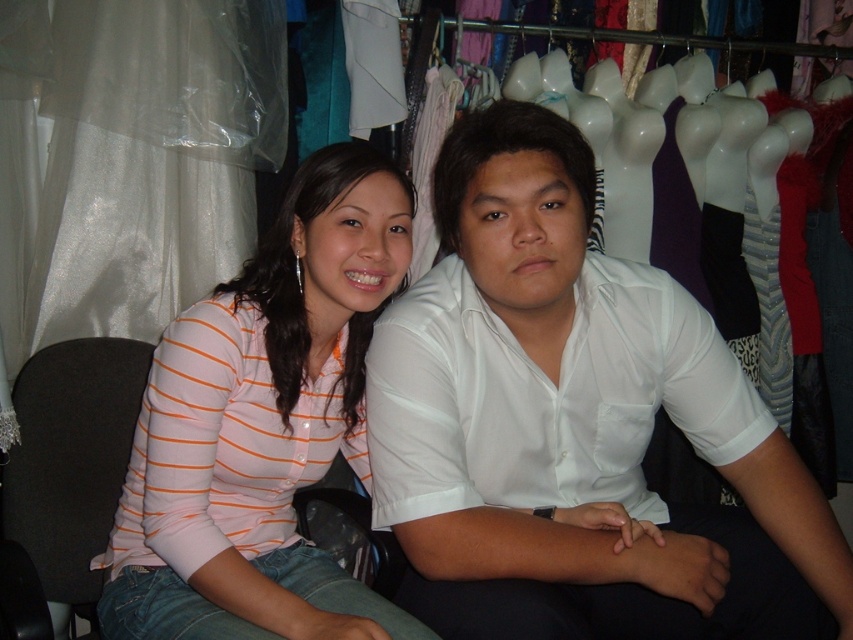
Question: Does white smooth shirt at center appear over pink striped shirt at center?

Choices:
 (A) yes
 (B) no

Answer: (B)

Question: Which point is farther to the camera?

Choices:
 (A) (701, 513)
 (B) (9, 477)
 (C) (265, 580)

Answer: (A)

Question: Which point is farther to the camera?

Choices:
 (A) (67, 572)
 (B) (273, 577)
 (C) (537, 237)

Answer: (A)

Question: Which point is farther to the camera?

Choices:
 (A) (113, 413)
 (B) (322, 152)
 (C) (387, 426)

Answer: (A)

Question: Is the position of white smooth shirt at center more distant than that of black fabric chair at left?

Choices:
 (A) yes
 (B) no

Answer: (B)

Question: Where is white smooth shirt at center located in relation to black fabric chair at left in the image?

Choices:
 (A) right
 (B) left

Answer: (A)